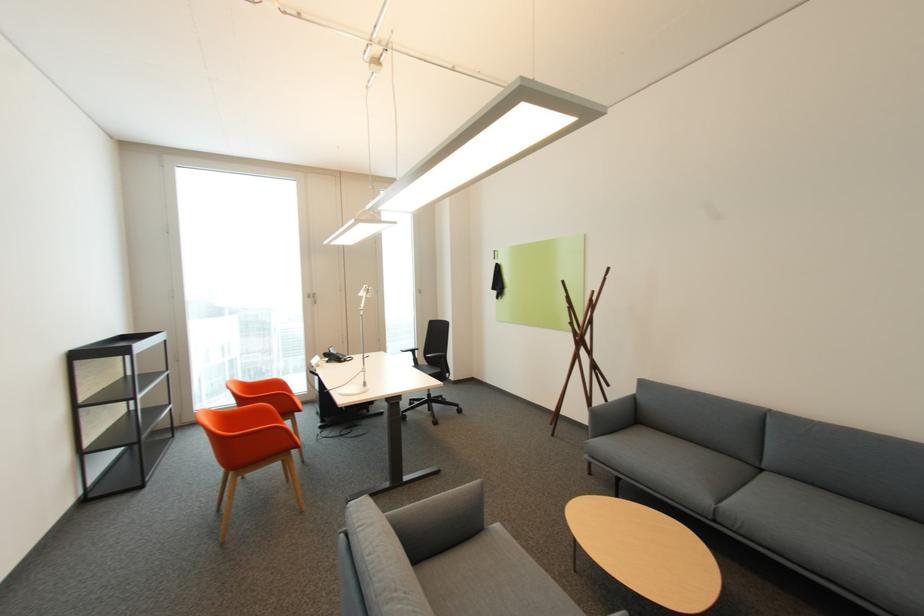
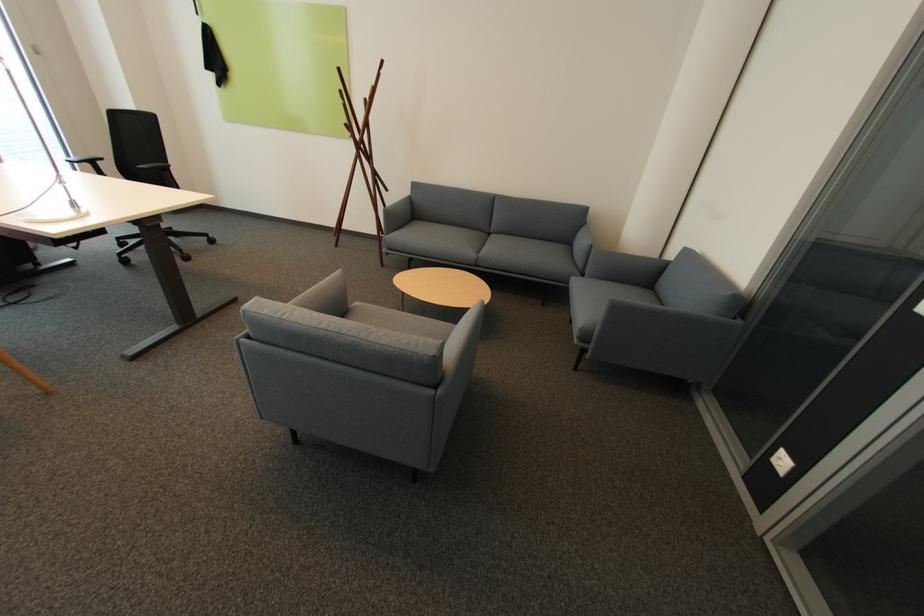
In the second image, find the point that corresponds to pixel 505 525 in the first image.

(362, 304)